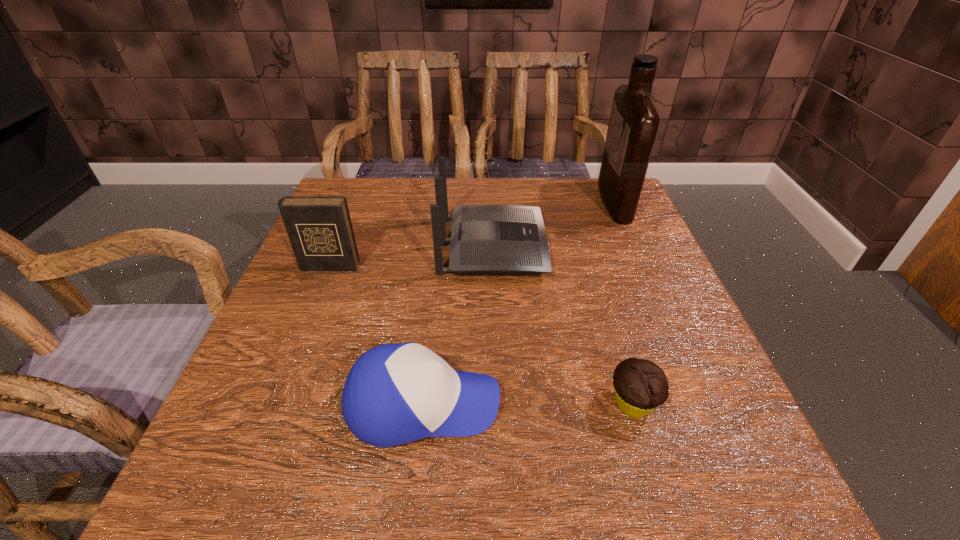
At what (x,y) coordinates should I click in order to perform the action: click on object that is at the far right corner. Please return your answer as a coordinate pair (x, y). This screenshot has height=540, width=960. Looking at the image, I should click on (633, 125).

You are a GUI agent. You are given a task and a screenshot of the screen. Output one action in this format:
    pyautogui.click(x=<x>, y=<y>)
    Task: Click on the free location at the far edge
    
    Given the screenshot: What is the action you would take?
    pyautogui.click(x=511, y=188)

In the image, there is a desktop. Where is `free space at the near edge`? free space at the near edge is located at coordinates (432, 485).

At what (x,y) coordinates should I click in order to perform the action: click on free space at the left edge. Please return your answer as a coordinate pair (x, y). Looking at the image, I should click on (300, 434).

Identify the location of vacant space at the right edge. This screenshot has width=960, height=540. (666, 346).

Find the location of `vacant area that lies between the baseball cap and the diary`. vacant area that lies between the baseball cap and the diary is located at coordinates (376, 335).

Identify the location of vacant space in between the tallest object and the router. The width and height of the screenshot is (960, 540). (553, 224).

Image resolution: width=960 pixels, height=540 pixels. Identify the location of free space between the diary and the router. (411, 256).

Image resolution: width=960 pixels, height=540 pixels. Identify the location of blank region between the second object from right to left and the router. (563, 325).

Find the location of a particular element. This screenshot has width=960, height=540. vacant point located between the second shortest object and the shortest object is located at coordinates (528, 404).